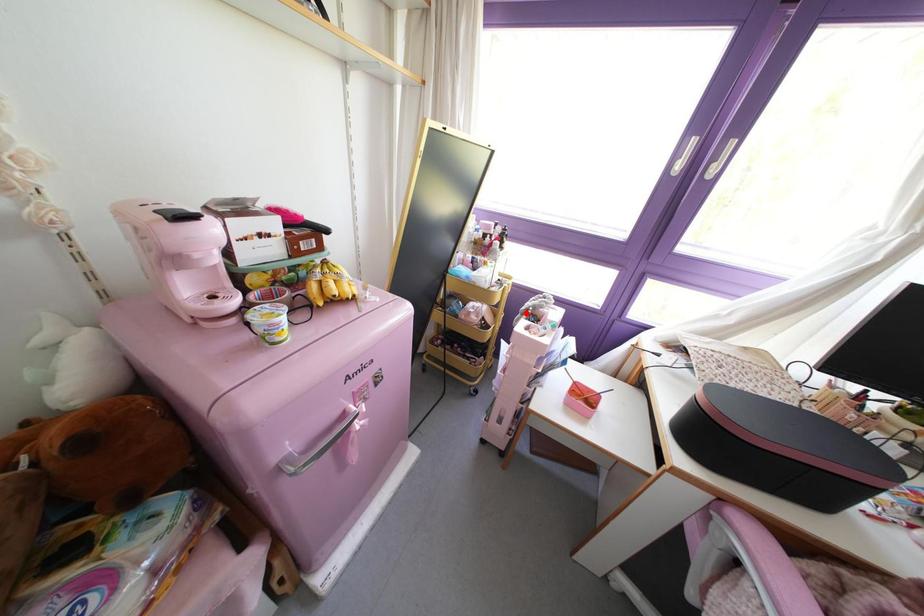
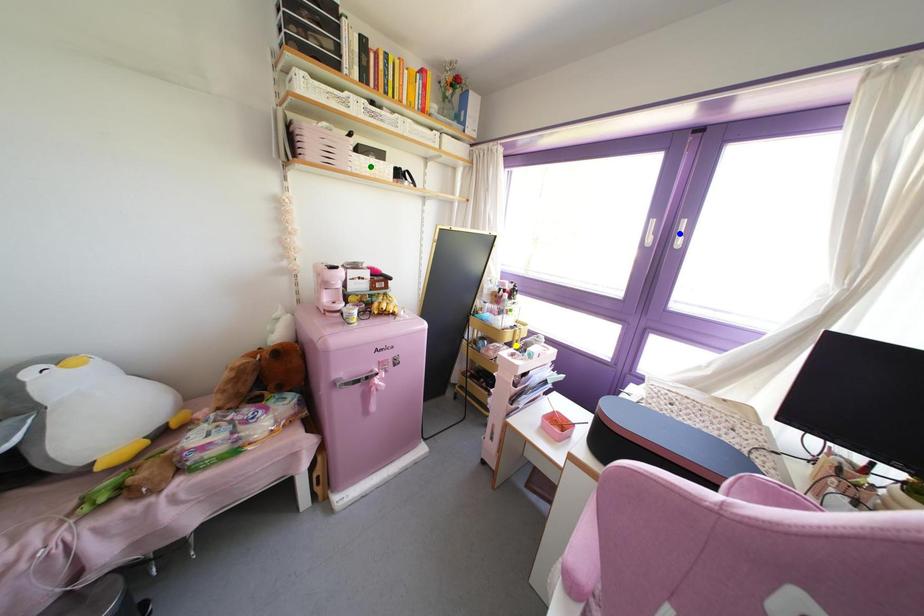
Question: I am providing you with two images of the same scene from different viewpoints. A red point is marked on the first image. You are given multiple points on the second image. Which spot in image 2 lines up with the point in image 1?

Choices:
 (A) yellow point
 (B) green point
 (C) blue point

Answer: (A)